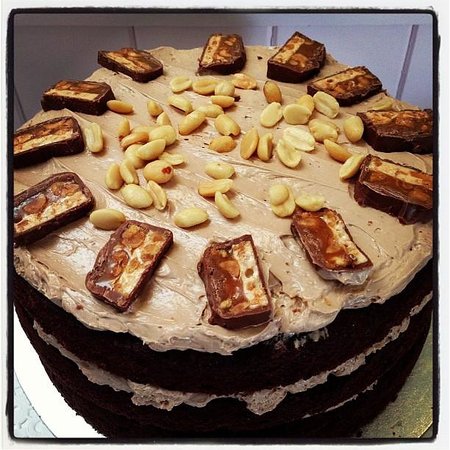
Where is `silver cake plate in lower left corner`? silver cake plate in lower left corner is located at coordinates (56, 414).